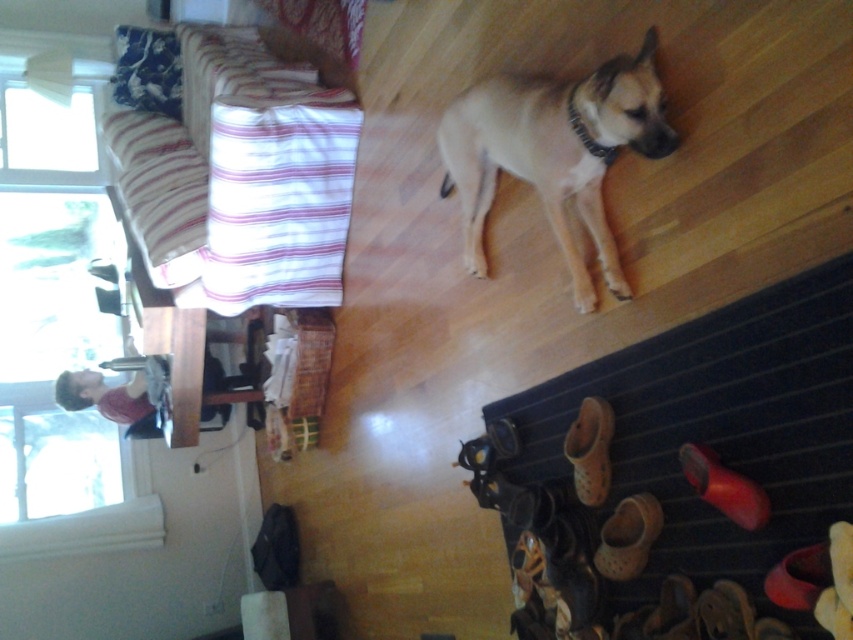
Does light brown fur at center have a larger size compared to brown mesh shoe at lower center?

Correct, light brown fur at center is larger in size than brown mesh shoe at lower center.

What do you see at coordinates (554, 152) in the screenshot?
I see `light brown fur at center` at bounding box center [554, 152].

At what (x,y) coordinates should I click in order to perform the action: click on light brown fur at center. Please return your answer as a coordinate pair (x, y). The image size is (853, 640). Looking at the image, I should click on (554, 152).

Who is more distant from viewer, (730,500) or (585,129)?

Positioned behind is point (585,129).

Is point (757, 499) behind point (601, 150)?

No, (757, 499) is in front of (601, 150).

The height and width of the screenshot is (640, 853). In order to click on rubber/leather shoe at lower right in this screenshot , I will do `click(724, 486)`.

Is light brown fur at center to the right of fluffy blue pillow at upper left from the viewer's perspective?

Indeed, light brown fur at center is positioned on the right side of fluffy blue pillow at upper left.

Is point (498, 104) positioned before point (138, 58)?

Yes.

The width and height of the screenshot is (853, 640). I want to click on light brown fur at center, so click(x=554, y=152).